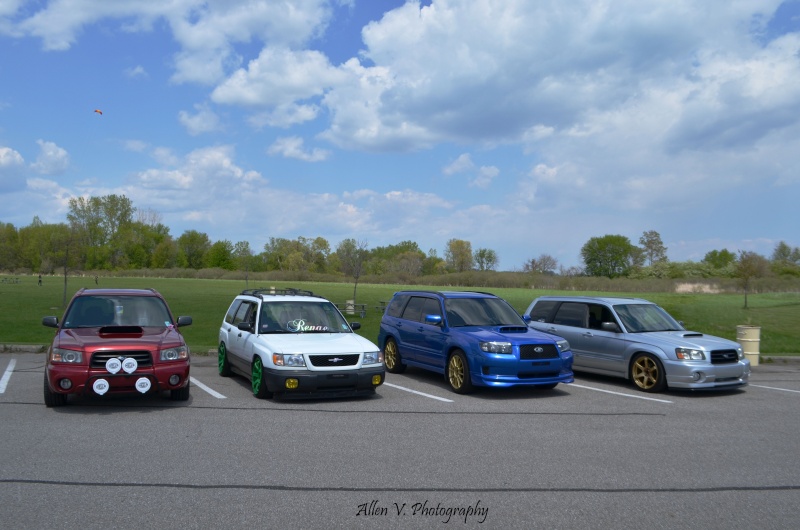
What are the coordinates of `mirrors` in the screenshot? It's located at (50, 320), (182, 314), (360, 326), (432, 316), (610, 323).